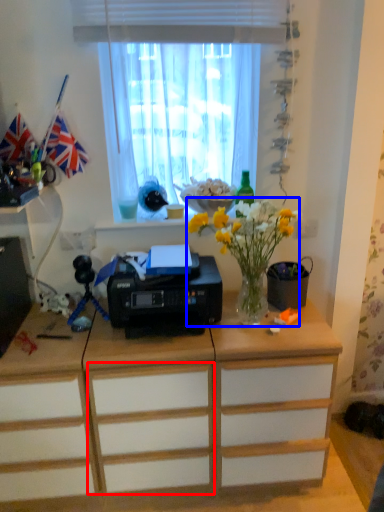
Question: Which object appears farthest to the camera in this image, drawer (highlighted by a red box) or floral arrangement (highlighted by a blue box)?

Choices:
 (A) drawer
 (B) floral arrangement

Answer: (A)